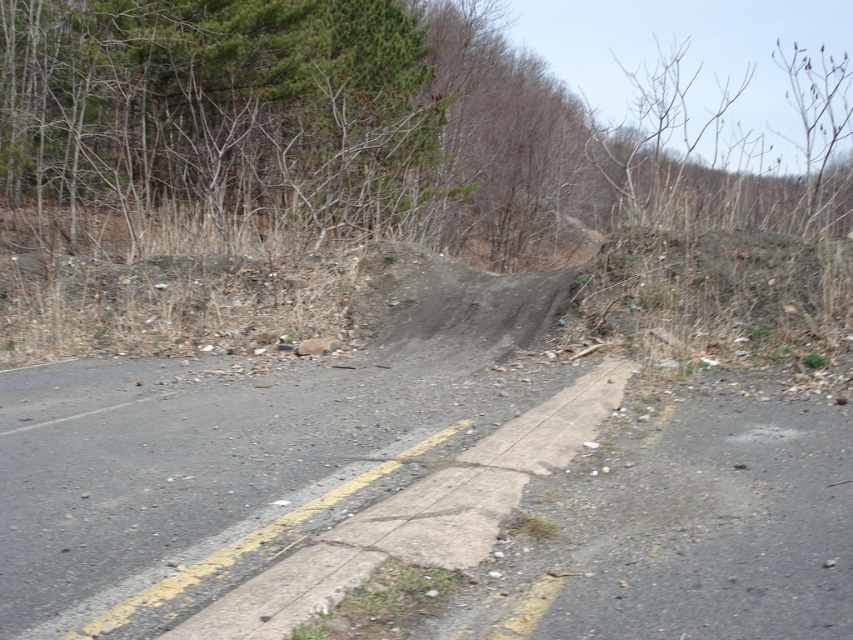
Question: Which object is closer to the camera taking this photo?

Choices:
 (A) gravelly asphalt road at center
 (B) green leafy tree at upper left

Answer: (A)

Question: In this image, where is green leafy tree at upper left located relative to gravelly asphalt road at center?

Choices:
 (A) right
 (B) left

Answer: (B)

Question: Which of the following is the closest to the observer?

Choices:
 (A) (27, 157)
 (B) (251, 598)

Answer: (B)

Question: Where is green leafy tree at upper left located in relation to gravelly asphalt road at center in the image?

Choices:
 (A) right
 (B) left

Answer: (B)

Question: Among these objects, which one is nearest to the camera?

Choices:
 (A) gravelly asphalt road at center
 (B) green leafy tree at upper left

Answer: (A)

Question: Is green leafy tree at upper left to the left of gravelly asphalt road at center from the viewer's perspective?

Choices:
 (A) no
 (B) yes

Answer: (B)